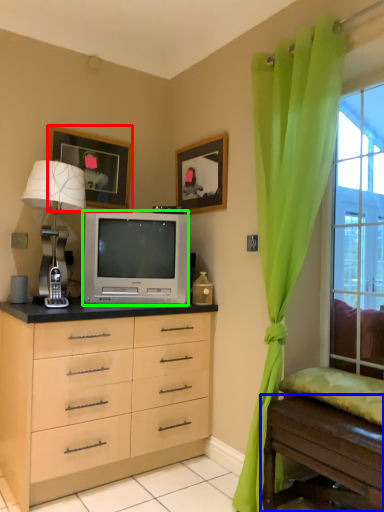
Question: Which object is positioned farthest from picture frame (highlighted by a red box)? Select from table (highlighted by a blue box) and television (highlighted by a green box).

Choices:
 (A) table
 (B) television

Answer: (A)